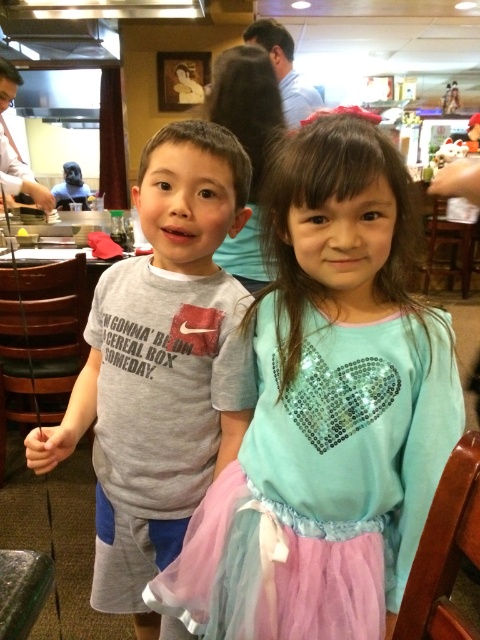
Question: Is light blue sequined shirt at center further to camera compared to gray cotton shirt at center?

Choices:
 (A) yes
 (B) no

Answer: (B)

Question: Among these points, which one is farthest from the camera?

Choices:
 (A) (386, 300)
 (B) (134, 593)

Answer: (B)

Question: Does light blue sequined shirt at center appear under pink tulle ballet skirt at lower center?

Choices:
 (A) no
 (B) yes

Answer: (A)

Question: Considering the real-world distances, which object is closest to the gray cotton shirt at center?

Choices:
 (A) pink tulle ballet skirt at lower center
 (B) light blue sequined shirt at center

Answer: (A)

Question: Based on their relative distances, which object is nearer to the light blue sequined shirt at center?

Choices:
 (A) gray cotton shirt at center
 (B) pink tulle ballet skirt at lower center

Answer: (A)

Question: Does light blue sequined shirt at center come behind pink tulle ballet skirt at lower center?

Choices:
 (A) yes
 (B) no

Answer: (B)